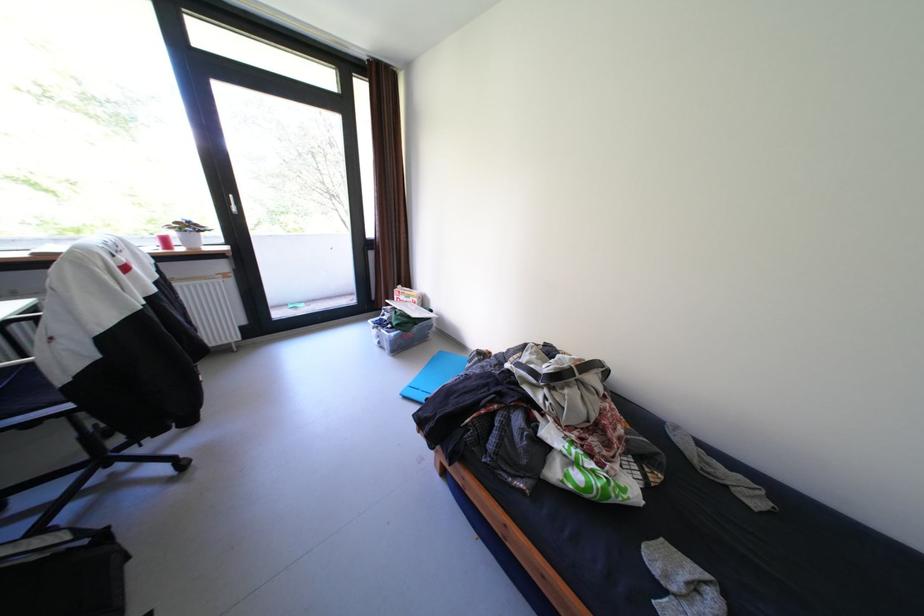
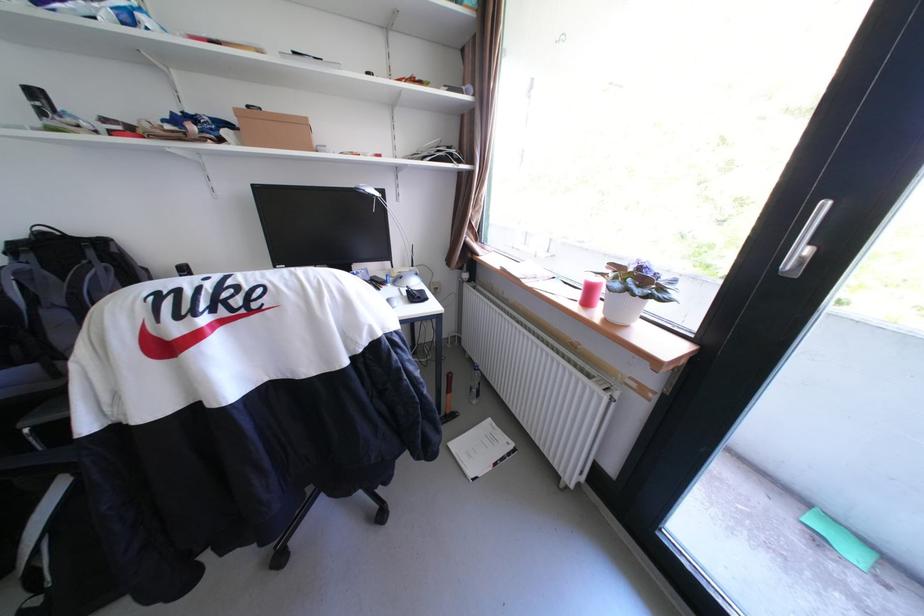
In the second image, find the point that corresponds to point 312,305 in the first image.

(867, 554)